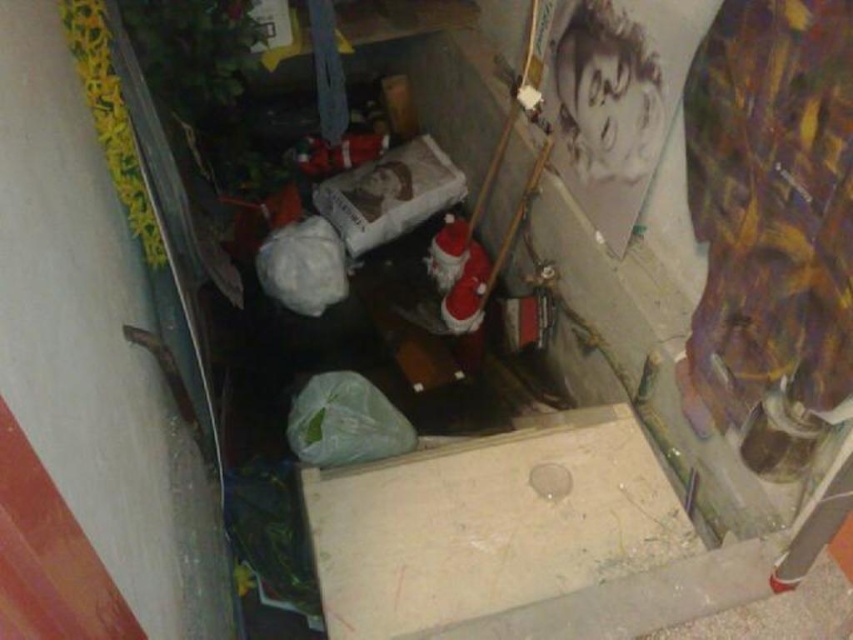
Can you confirm if white matte plastic bag at center is positioned above transparent plastic hole at center?

Yes, white matte plastic bag at center is above transparent plastic hole at center.

Describe the element at coordinates (303, 266) in the screenshot. I see `white matte plastic bag at center` at that location.

This screenshot has width=853, height=640. What are the coordinates of `white matte plastic bag at center` in the screenshot? It's located at (303, 266).

Between green plastic bag at center and white matte plastic bag at center, which one has less height?

green plastic bag at center is shorter.

Between point (351, 454) and point (305, 218), which one is positioned in front?

Point (351, 454) is in front.

Between point (373, 435) and point (325, 243), which one is positioned behind?

The point (325, 243) is behind.

Image resolution: width=853 pixels, height=640 pixels. I want to click on green plastic bag at center, so click(x=345, y=420).

Who is taller, green plastic bag at center or transparent plastic hole at center?

green plastic bag at center

Does green plastic bag at center have a lesser height compared to transparent plastic hole at center?

Incorrect, green plastic bag at center's height does not fall short of transparent plastic hole at center's.

Locate an element on the screen. green plastic bag at center is located at coordinates (345, 420).

In order to click on green plastic bag at center in this screenshot , I will do `click(345, 420)`.